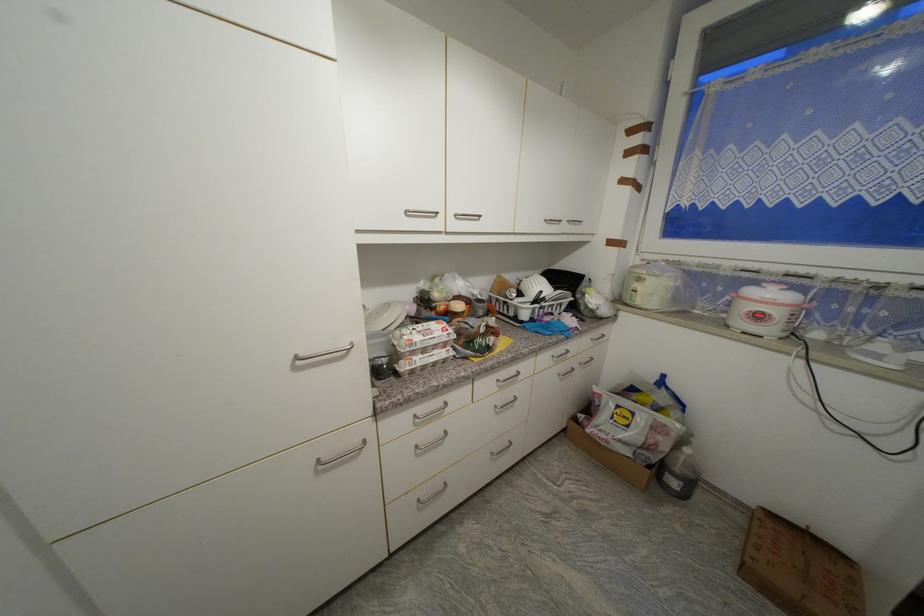
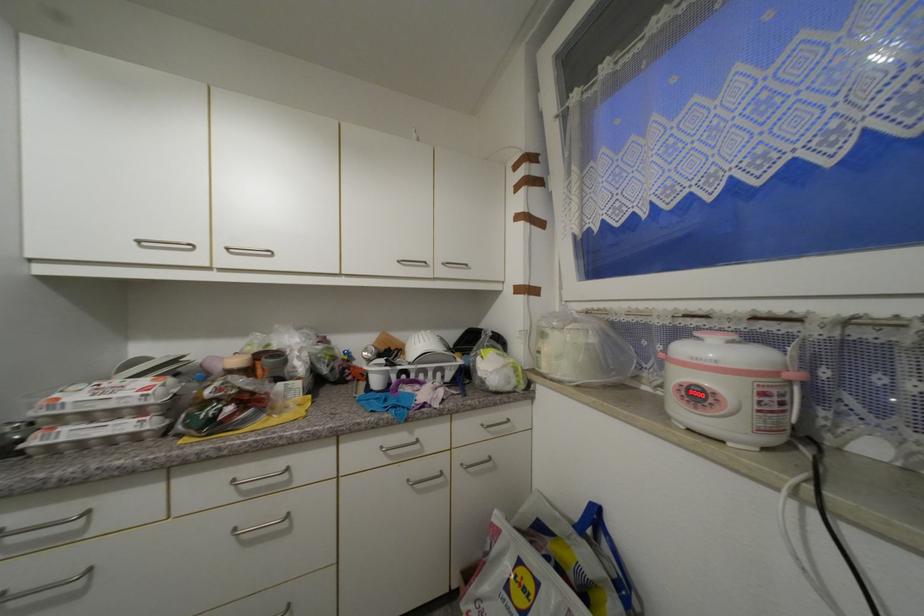
Locate, in the second image, the point that corresponds to pixel 812 307 in the first image.

(799, 378)